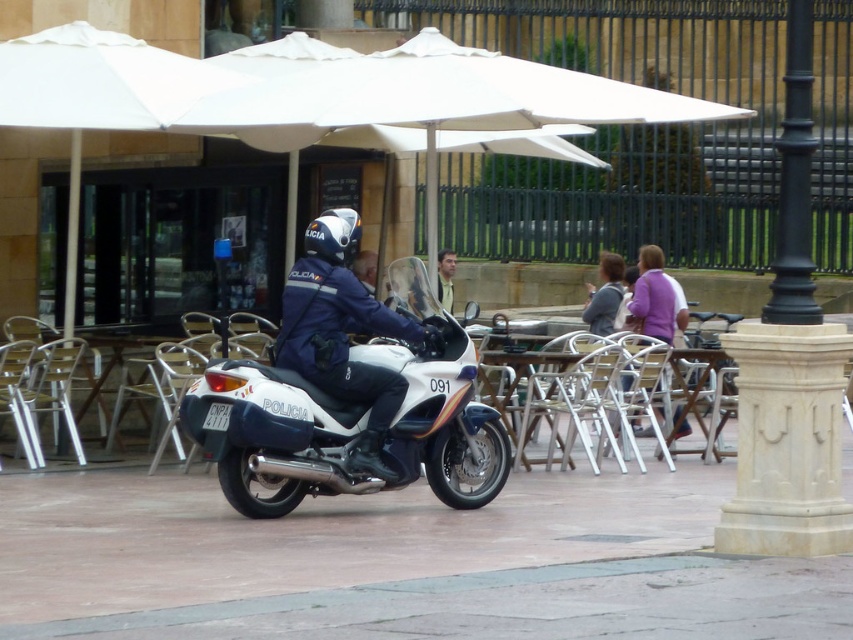
Question: Can you confirm if blue fabric uniform at center is smaller than purple sweater at center?

Choices:
 (A) yes
 (B) no

Answer: (B)

Question: Is white glossy motorcycle at center positioned at the back of metallic silver chair at left?

Choices:
 (A) yes
 (B) no

Answer: (B)

Question: Which of the following is the closest to the observer?

Choices:
 (A) (450, 442)
 (B) (306, 316)
 (C) (38, 352)
 (D) (616, 284)

Answer: (B)

Question: Based on their relative distances, which object is farther from the white glossy motorcycle at center?

Choices:
 (A) metallic silver chair at left
 (B) blue fabric uniform at center
 (C) purple sweater at center

Answer: (C)

Question: Considering the relative positions of white glossy motorcycle at center and metallic silver chair at left in the image provided, where is white glossy motorcycle at center located with respect to metallic silver chair at left?

Choices:
 (A) left
 (B) right

Answer: (B)

Question: Which point is closer to the camera?

Choices:
 (A) blue fabric uniform at center
 (B) metallic silver chair at left
 (C) light brown leather jacket at center
 (D) white glossy motorcycle at center

Answer: (D)